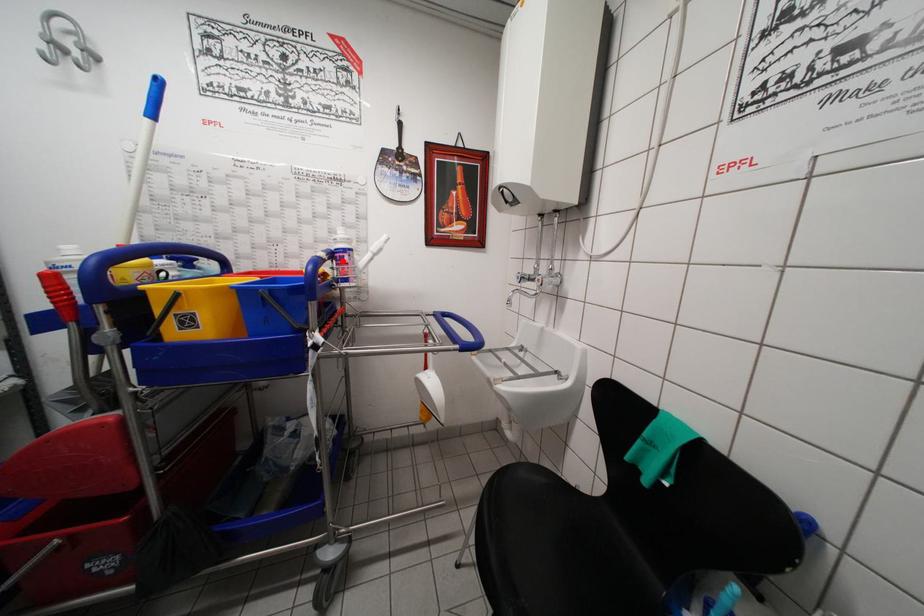
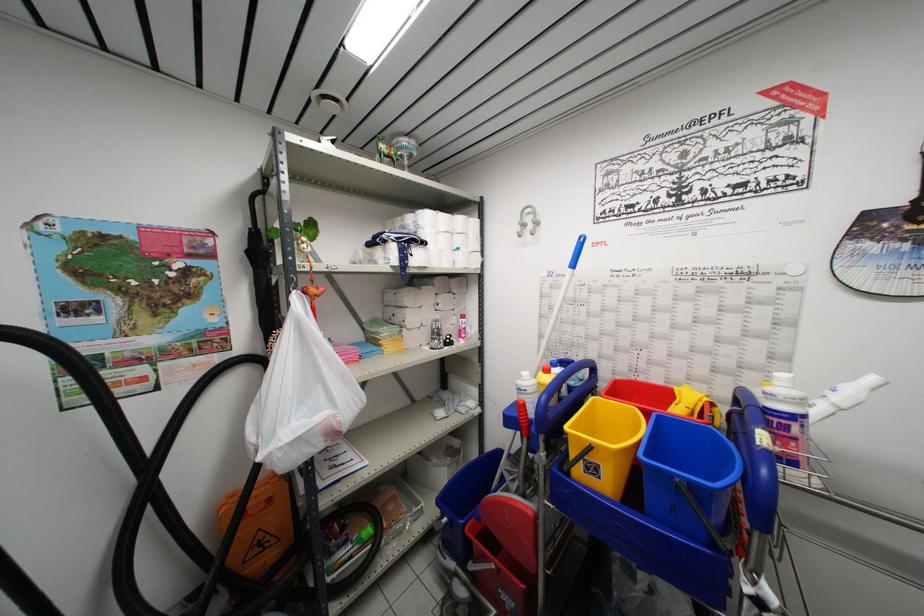
Find the pixel in the second image that matches the highlighted location in the first image.

(783, 428)